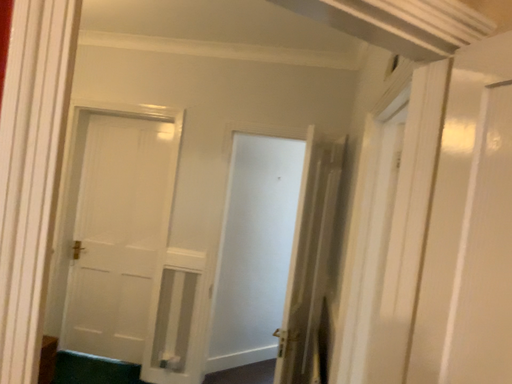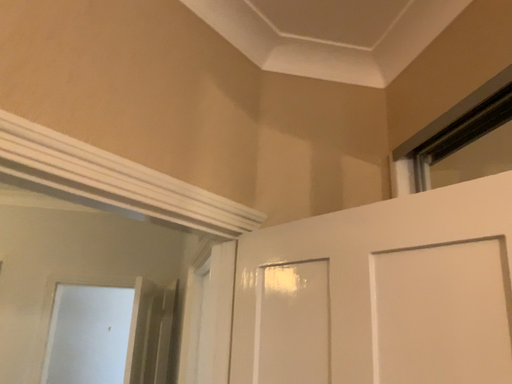
Question: Which way did the camera rotate in the video?

Choices:
 (A) rotated right
 (B) rotated left

Answer: (A)